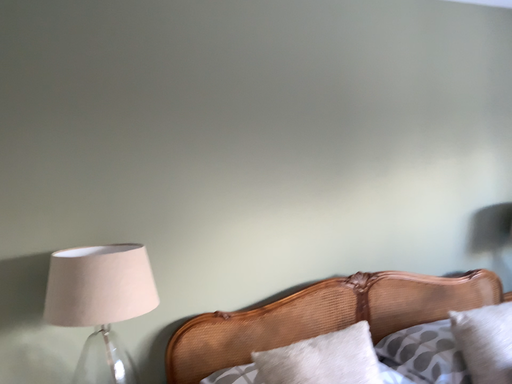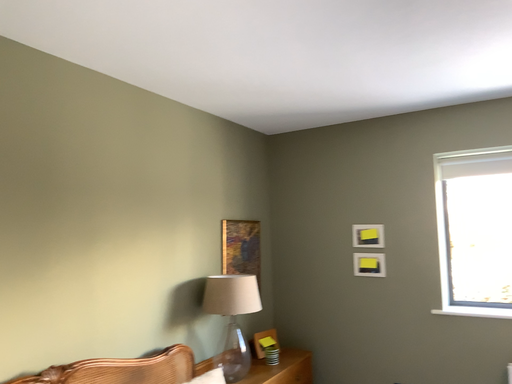
Question: How did the camera likely rotate when shooting the video?

Choices:
 (A) rotated right
 (B) rotated left

Answer: (A)